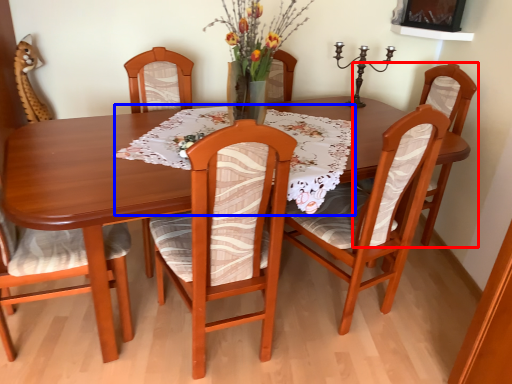
Question: Which object appears farthest to the camera in this image, chair (highlighted by a red box) or tablecloth (highlighted by a blue box)?

Choices:
 (A) chair
 (B) tablecloth

Answer: (A)